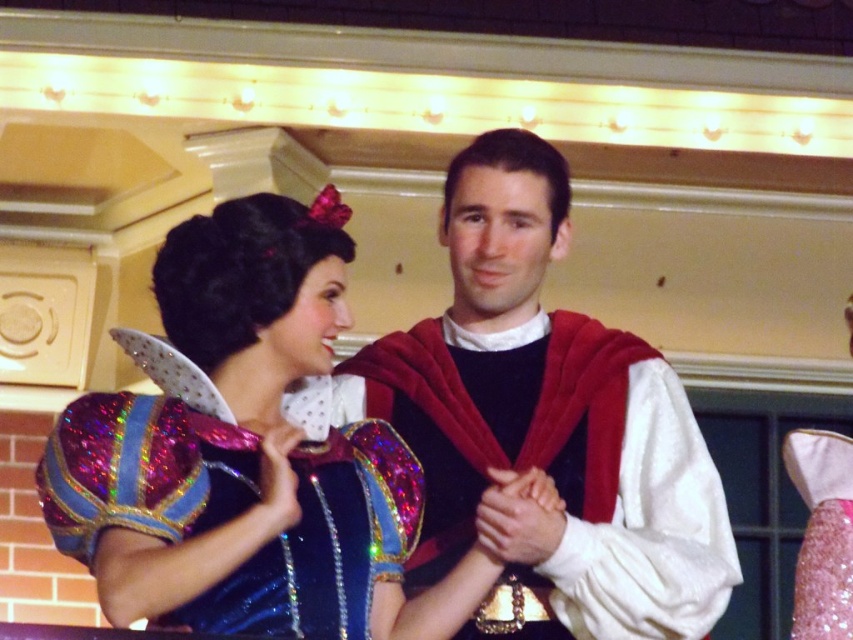
Between point (604, 336) and point (846, 540), which one is positioned in front?

Point (846, 540)

Can you confirm if velvet red cape at center is thinner than pink glitter dress at center?

No, velvet red cape at center is not thinner than pink glitter dress at center.

The height and width of the screenshot is (640, 853). I want to click on velvet red cape at center, so click(549, 422).

Which is behind, point (154, 524) or point (467, 444)?

The point (467, 444) is behind.

Who is more forward, (260, 298) or (573, 408)?

Point (260, 298) is more forward.

Where is `sparkly blue dress at center`? The width and height of the screenshot is (853, 640). sparkly blue dress at center is located at coordinates (247, 452).

Which is more to the left, sparkly blue dress at center or pink glitter dress at center?

From the viewer's perspective, sparkly blue dress at center appears more on the left side.

Does sparkly blue dress at center have a greater height compared to pink glitter dress at center?

Yes, sparkly blue dress at center is taller than pink glitter dress at center.

Image resolution: width=853 pixels, height=640 pixels. What do you see at coordinates (247, 452) in the screenshot?
I see `sparkly blue dress at center` at bounding box center [247, 452].

Locate an element on the screen. The height and width of the screenshot is (640, 853). sparkly blue dress at center is located at coordinates (247, 452).